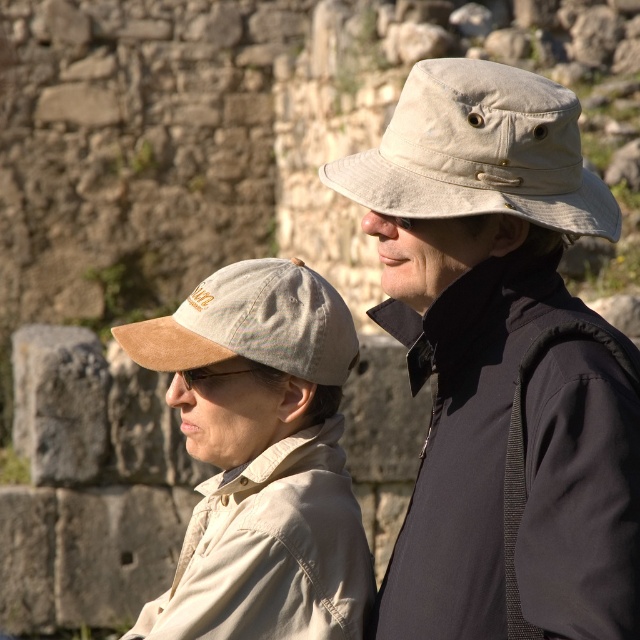
Who is shorter, beige fabric baseball cap at upper center or tan suede baseball cap at left?

Standing shorter between the two is tan suede baseball cap at left.

Who is positioned more to the left, beige fabric baseball cap at upper center or tan suede baseball cap at left?

Positioned to the left is tan suede baseball cap at left.

Between point (563, 122) and point (291, 285), which one is positioned behind?

The point (291, 285) is more distant.

You are a GUI agent. You are given a task and a screenshot of the screen. Output one action in this format:
    pyautogui.click(x=<x>, y=<y>)
    Task: Click on the beige fabric baseball cap at upper center
    
    Given the screenshot: What is the action you would take?
    481,152

Is tan suede cap at left behind matte brown goggles at center?

No, tan suede cap at left is in front of matte brown goggles at center.

Who is taller, tan suede cap at left or matte brown goggles at center?

With more height is tan suede cap at left.

Measure the distance between point (371, 580) and camera.

Point (371, 580) is 38.83 meters from camera.

Where is `tan suede cap at left`? This screenshot has width=640, height=640. tan suede cap at left is located at coordinates (260, 458).

Which is behind, point (314, 301) or point (196, 376)?

Point (196, 376)

The height and width of the screenshot is (640, 640). I want to click on tan suede baseball cap at left, so click(252, 323).